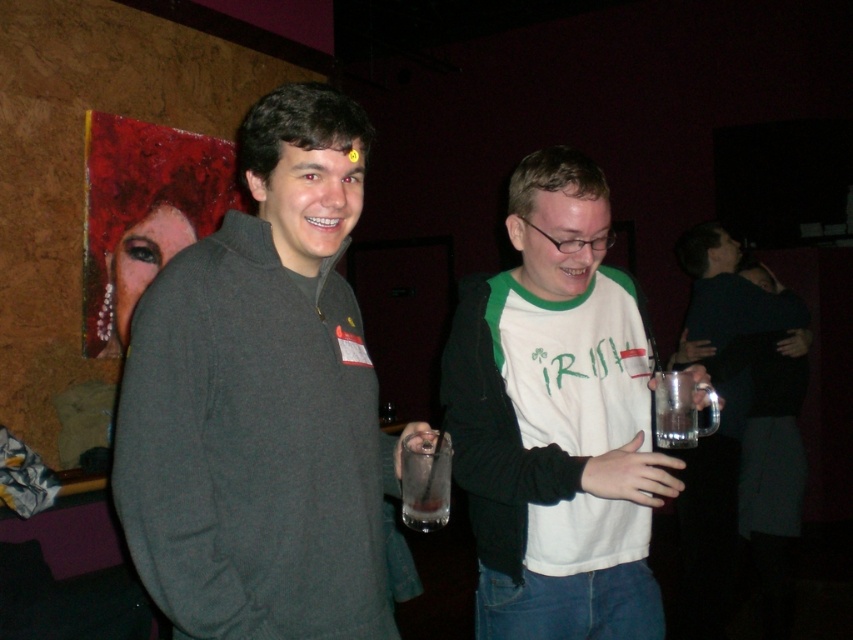
You are a bartender at the party and need to reach the clear glass mug at right. Considering the distance between you and the mug, can you hand it to the customer without moving from your current position?

The clear glass mug at right is 8.91 feet away from the camera, which is a considerable distance. Since you are a bartender, you might need to move closer to reach it, so you cannot hand it to the customer without moving from your current position.

You are at a party and want to grab a drink without moving from your spot. You see the dark gray sweater at center and the clear glass at right. Which object is closer to your current position?

The dark gray sweater at center is located above the clear glass at right, so the clear glass at right is closer to your current position since it is below the sweater.